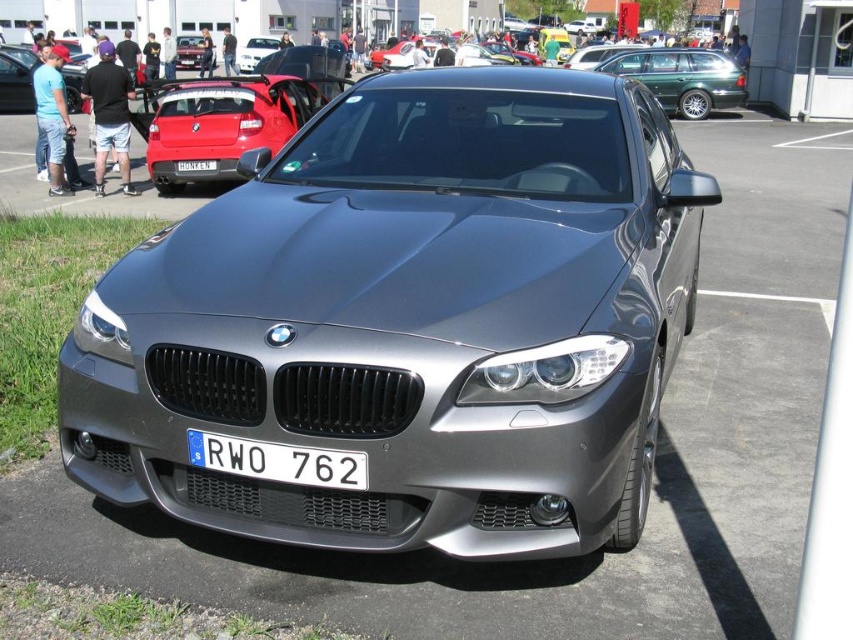
You are a photographer trying to capture a photo of the metallic red car at center. However, there is a matte black sedan at upper left blocking your view. Based on their heights, can you determine if the sedan is taller than the car you want to photograph?

The matte black sedan at upper left is much taller than the metallic red car at center, so it is likely blocking the view of the metallic red car at center due to its greater height.

You are a photographer trying to capture the white plastic license plate at center without any obstructions. Is the metallic green wagon at upper right blocking your view of the license plate?

The metallic green wagon at upper right is positioned over white plastic license plate at center, so yes, the wagon is blocking the license plate.